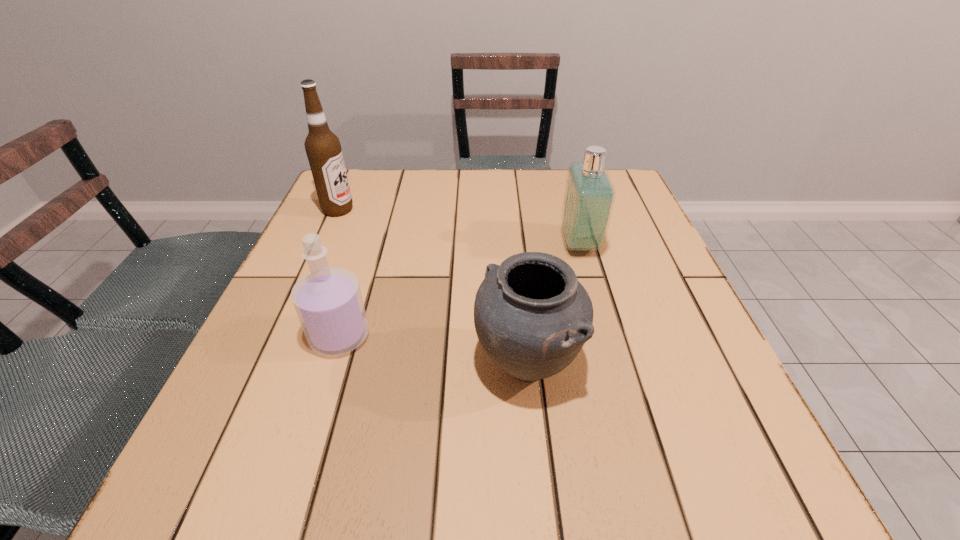
Find the location of a particular element. This screenshot has height=540, width=960. free region at the left edge of the desktop is located at coordinates (279, 319).

You are a GUI agent. You are given a task and a screenshot of the screen. Output one action in this format:
    pyautogui.click(x=<x>, y=<y>)
    Task: Click on the vacant region at the right edge of the desktop
    
    Given the screenshot: What is the action you would take?
    pyautogui.click(x=619, y=286)

In the image, there is a desktop. Identify the location of free space at the near left corner. (219, 472).

Find the location of a particular element. The width and height of the screenshot is (960, 540). free space at the near right corner of the desktop is located at coordinates 735,481.

This screenshot has width=960, height=540. In order to click on blank region between the left perfume and the urn in this screenshot , I will do `click(433, 350)`.

Where is `unoccupied area between the right perfume and the nearer perfume`? The height and width of the screenshot is (540, 960). unoccupied area between the right perfume and the nearer perfume is located at coordinates (460, 290).

This screenshot has width=960, height=540. I want to click on unoccupied position between the tallest object and the second object from right to left, so click(433, 287).

Where is `free spot between the third object from left to right and the leftmost object`? This screenshot has height=540, width=960. free spot between the third object from left to right and the leftmost object is located at coordinates (433, 287).

The width and height of the screenshot is (960, 540). In order to click on vacant space in between the tallest object and the rightmost object in this screenshot , I will do `click(459, 227)`.

This screenshot has height=540, width=960. What are the coordinates of `empty space between the leftmost object and the urn` in the screenshot? It's located at (433, 287).